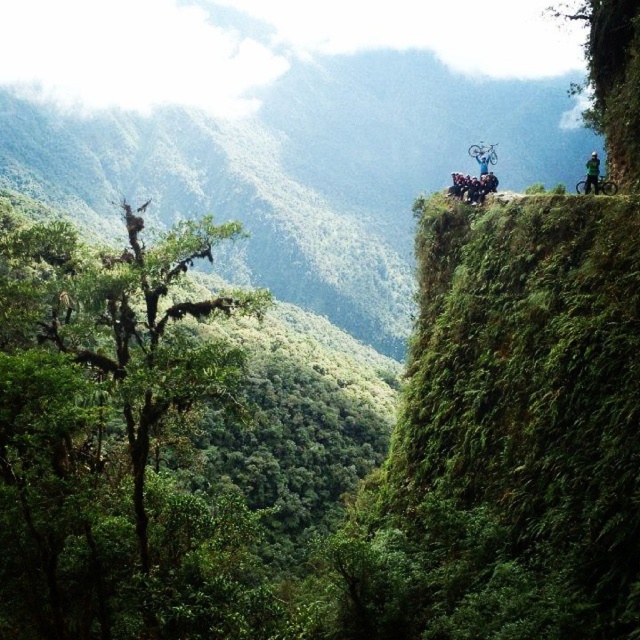
Does green leafy tree at left appear on the left side of green matte helmet at upper right?

Indeed, green leafy tree at left is positioned on the left side of green matte helmet at upper right.

Can you confirm if green leafy tree at left is wider than green matte helmet at upper right?

In fact, green leafy tree at left might be narrower than green matte helmet at upper right.

Is point (10, 420) positioned in front of point (588, 180)?

That is True.

The height and width of the screenshot is (640, 640). Identify the location of green leafy tree at left. (109, 436).

How much distance is there between green matte mountain bike at upper right and green matte helmet at upper right?

A distance of 24.27 meters exists between green matte mountain bike at upper right and green matte helmet at upper right.

Between green matte mountain bike at upper right and green matte helmet at upper right, which one is positioned lower?

green matte helmet at upper right is below.

Does point (609, 180) lie behind point (595, 176)?

Yes, it is.

Locate an element on the screen. This screenshot has width=640, height=640. green matte mountain bike at upper right is located at coordinates (605, 186).

Does green leafy mountain at upper right lie behind green matte mountain bike at upper right?

Yes, green leafy mountain at upper right is further from the viewer.

Identify the location of green leafy mountain at upper right. (282, 128).